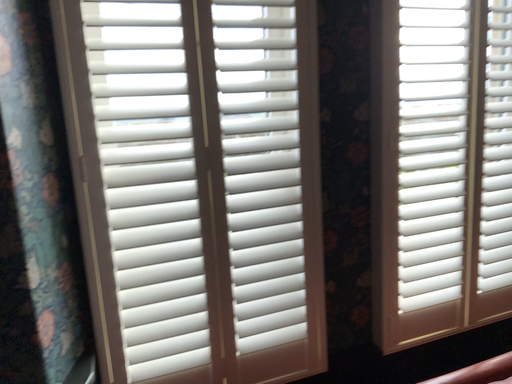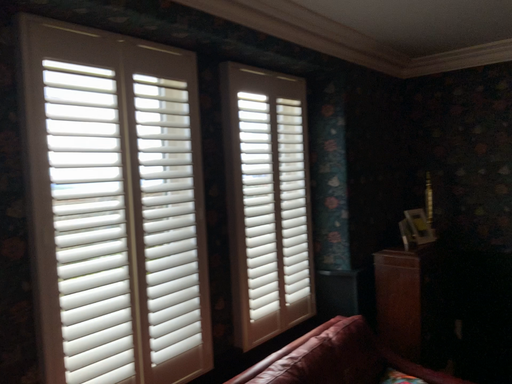
Question: Which way did the camera rotate in the video?

Choices:
 (A) rotated upward
 (B) rotated downward

Answer: (A)